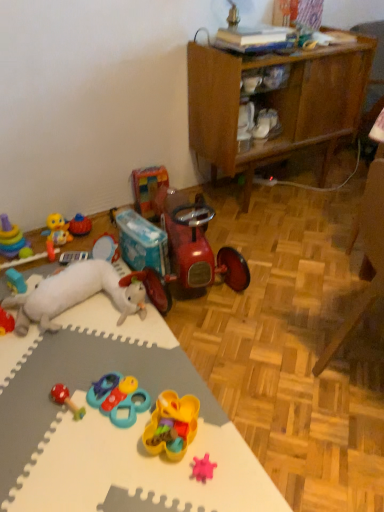
The width and height of the screenshot is (384, 512). What are the coordinates of `vacant area that is in front of translucent yellow plastic toy at center, the second toy in the right-to-left sequence` in the screenshot? It's located at (172, 485).